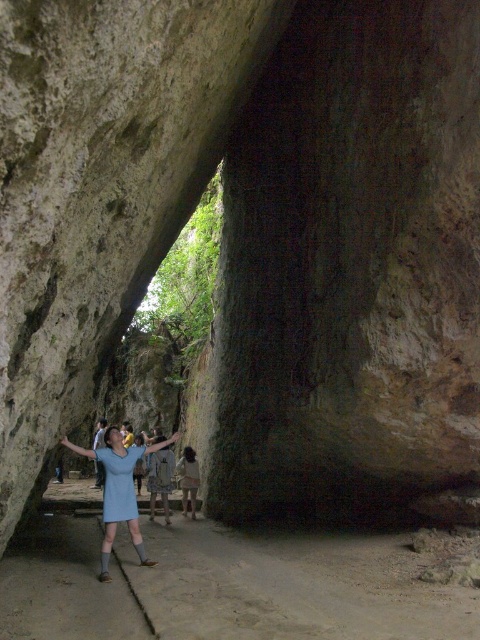
Question: Which object is closer to the camera taking this photo?

Choices:
 (A) light blue fabric dress at center
 (B) blue dress at center

Answer: (A)

Question: Which of the following is the closest to the observer?

Choices:
 (A) (99, 465)
 (B) (132, 456)

Answer: (B)

Question: Which object appears closest to the camera in this image?

Choices:
 (A) light brown fabric dress at center
 (B) blue dress at center
 (C) light blue fabric dress at center

Answer: (C)

Question: Can you confirm if light blue fabric dress at center is thinner than blue dress at center?

Choices:
 (A) yes
 (B) no

Answer: (A)

Question: Can you confirm if light blue fabric dress at center is positioned below blue dress at center?

Choices:
 (A) no
 (B) yes

Answer: (A)

Question: Is light blue fabric dress at center wider than blue dress at center?

Choices:
 (A) yes
 (B) no

Answer: (B)